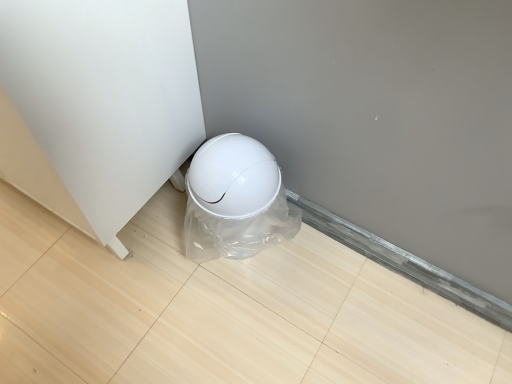
Find the location of `vacant position to the left of white glossy waste container at lower left`. vacant position to the left of white glossy waste container at lower left is located at coordinates (156, 242).